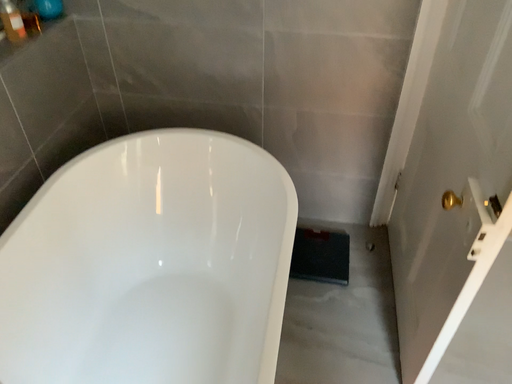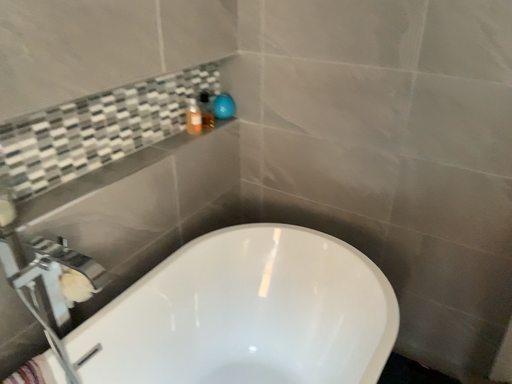
Question: Which way did the camera rotate in the video?

Choices:
 (A) rotated left
 (B) rotated right

Answer: (A)